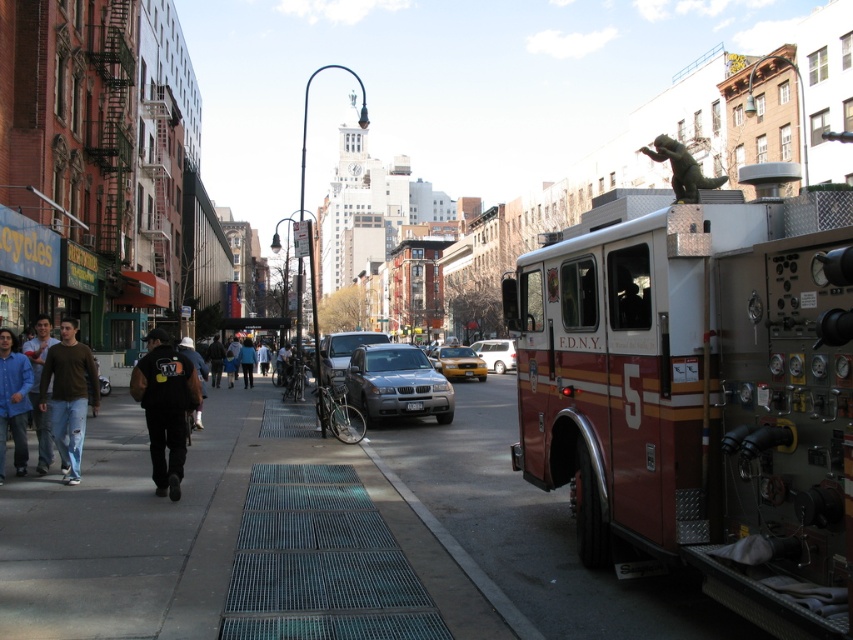
Does jeans at left have a larger size compared to silver metallic van at center?

Actually, jeans at left might be smaller than silver metallic van at center.

Who is more forward, (x=48, y=323) or (x=509, y=339)?

Point (x=48, y=323)

Who is more forward, (28, 349) or (503, 371)?

Point (28, 349)

Where is `jeans at left`? Image resolution: width=853 pixels, height=640 pixels. jeans at left is located at coordinates (38, 388).

At what (x,y) coordinates should I click in order to perform the action: click on brown matte sweater at lower left. Please return your answer as a coordinate pair (x, y). Looking at the image, I should click on (68, 396).

What do you see at coordinates (68, 396) in the screenshot? I see `brown matte sweater at lower left` at bounding box center [68, 396].

Which is behind, point (50, 419) or point (3, 380)?

Positioned behind is point (50, 419).

Locate an element on the screen. The image size is (853, 640). brown matte sweater at lower left is located at coordinates (68, 396).

Is black backpack at center bigger than blue denim jeans at center?

Indeed, black backpack at center has a larger size compared to blue denim jeans at center.

What do you see at coordinates (215, 360) in the screenshot? I see `black backpack at center` at bounding box center [215, 360].

Where is `black backpack at center`? This screenshot has width=853, height=640. black backpack at center is located at coordinates (215, 360).